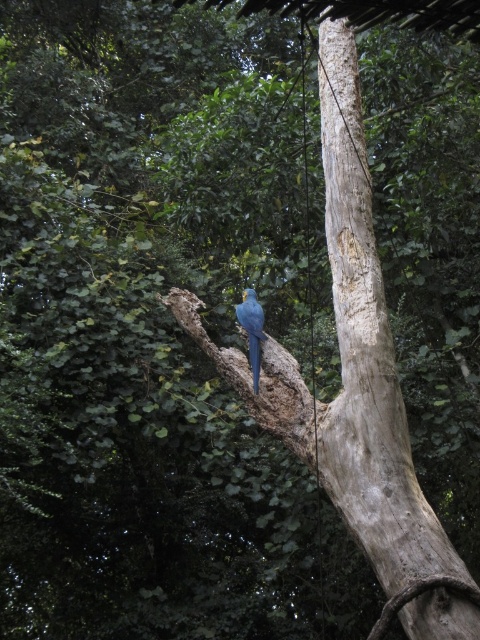
Does smooth brown tree trunk at center lie in front of blue glossy parrot at center?

Yes, it is in front of blue glossy parrot at center.

Which is more to the left, smooth brown tree trunk at center or blue glossy parrot at center?

blue glossy parrot at center is more to the left.

Is point (351, 49) behind point (251, 340)?

Yes, point (351, 49) is behind point (251, 340).

At what (x,y) coordinates should I click in order to perform the action: click on smooth brown tree trunk at center. Please return your answer as a coordinate pair (x, y). This screenshot has width=480, height=640. Looking at the image, I should click on (367, 356).